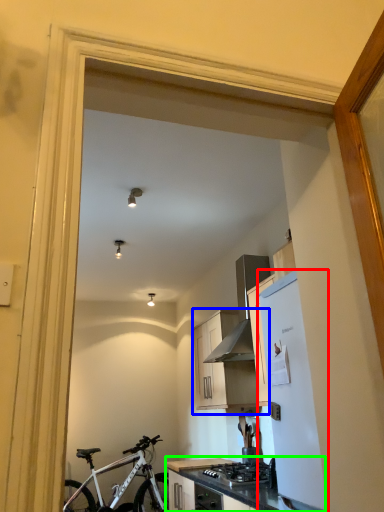
Question: Which is farther away from refrigerator (highlighted by a red box)? cabinetry (highlighted by a blue box) or countertop (highlighted by a green box)?

Choices:
 (A) cabinetry
 (B) countertop

Answer: (A)